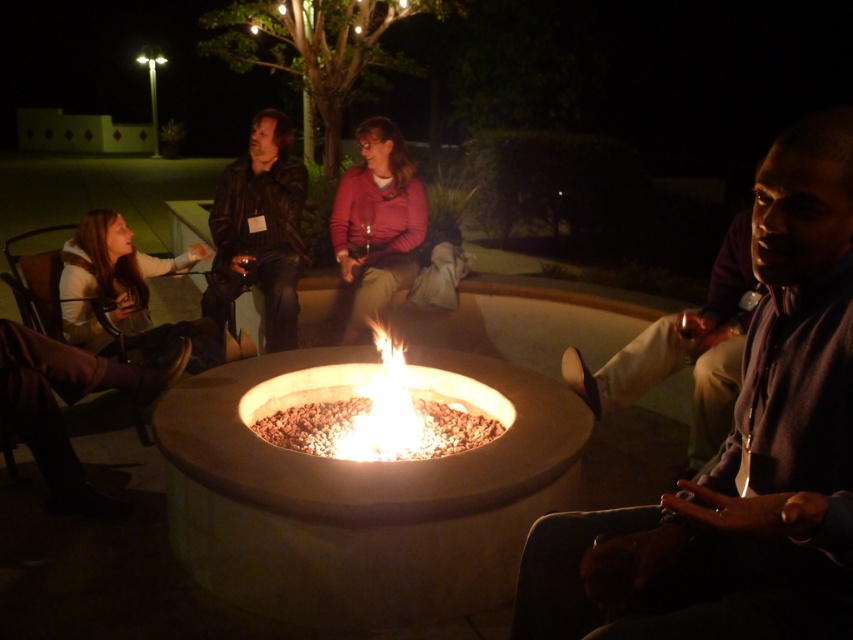
Image resolution: width=853 pixels, height=640 pixels. In order to click on dark brown leather shoe at lower right in this screenshot , I will do `click(686, 349)`.

Who is shorter, dark brown leather shoe at lower right or flamematerial/texture at center?

Standing shorter between the two is flamematerial/texture at center.

This screenshot has width=853, height=640. Describe the element at coordinates (686, 349) in the screenshot. I see `dark brown leather shoe at lower right` at that location.

Where is `dark brown leather shoe at lower right`? This screenshot has height=640, width=853. dark brown leather shoe at lower right is located at coordinates (686, 349).

Can you confirm if dark blue shirt at center is thinner than flameing stonelike fire pit at center?

Yes.

Is dark blue shirt at center wider than flameing stonelike fire pit at center?

Incorrect, dark blue shirt at center's width does not surpass flameing stonelike fire pit at center's.

Is point (688, 502) in front of point (257, 433)?

Yes, point (688, 502) is in front of point (257, 433).

This screenshot has width=853, height=640. I want to click on dark blue shirt at center, so click(740, 452).

Does point (428, 618) lie behind point (734, 221)?

No, (428, 618) is in front of (734, 221).

How much distance is there between concrete fire pit at center and dark brown leather shoe at lower right?

concrete fire pit at center is 95.03 centimeters away from dark brown leather shoe at lower right.

This screenshot has height=640, width=853. Describe the element at coordinates (363, 492) in the screenshot. I see `concrete fire pit at center` at that location.

Where is `concrete fire pit at center`? The height and width of the screenshot is (640, 853). concrete fire pit at center is located at coordinates (363, 492).